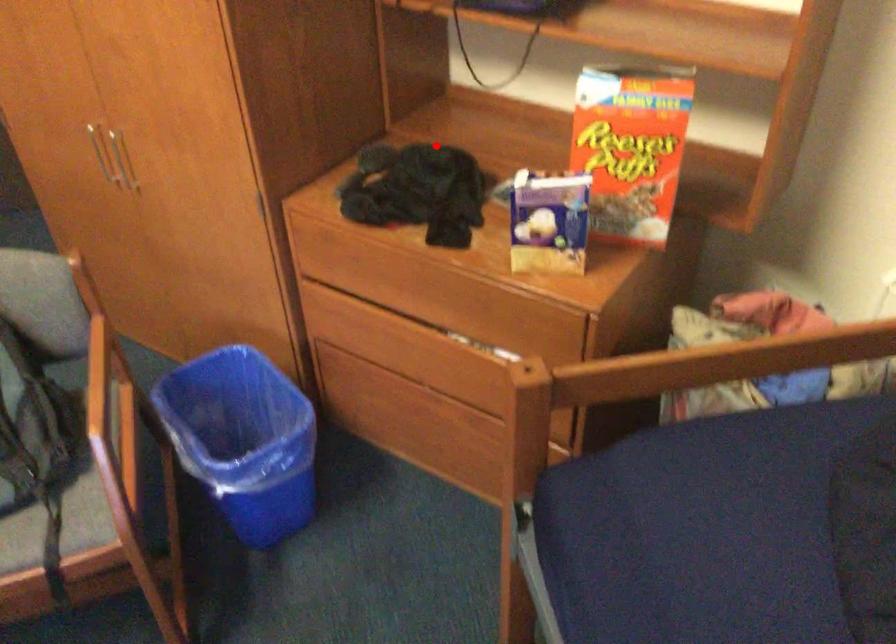
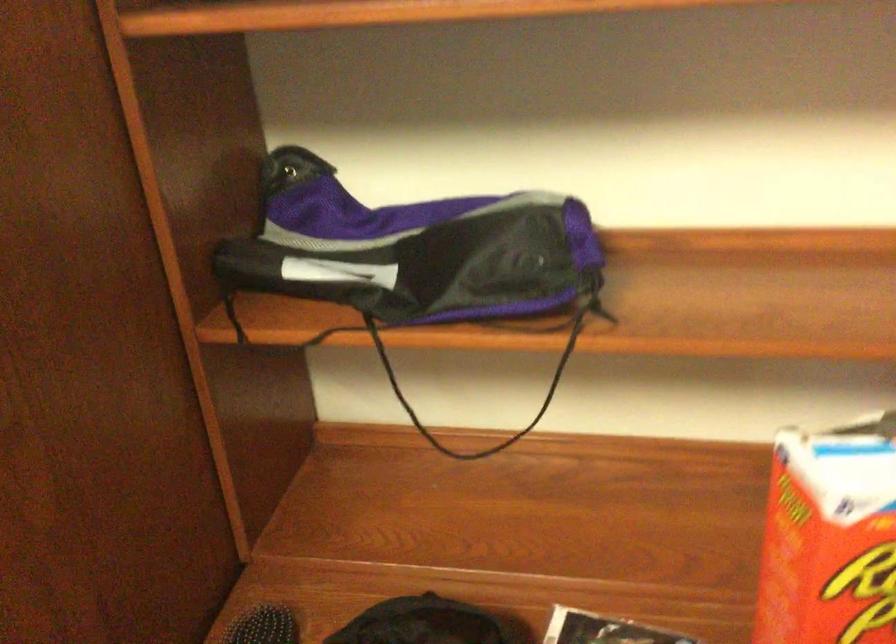
Where in the second image is the point corresponding to the highlighted location from the first image?

(419, 623)